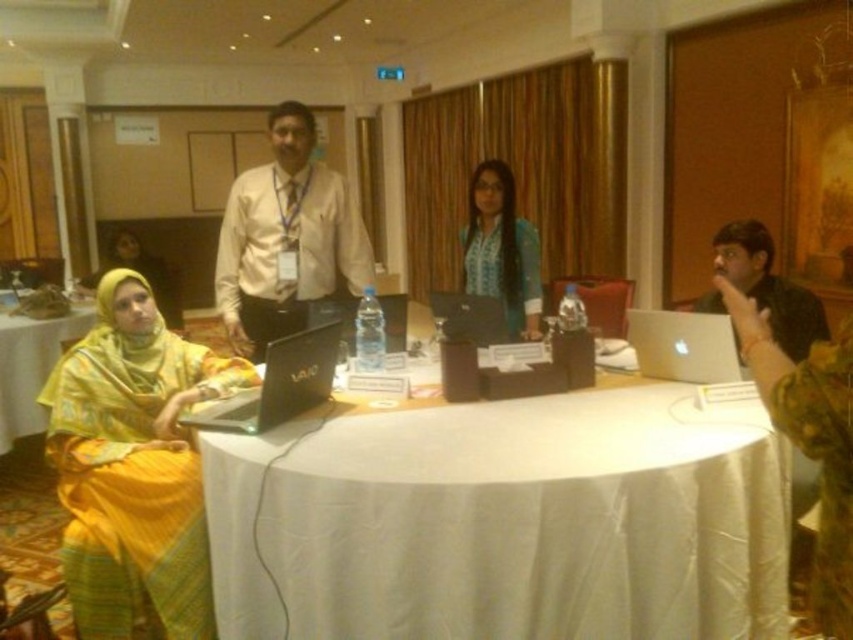
You are a guest attending a formal meeting and need to place your nameplate on the table. The table has a white satin tablecloth at center and you are wearing a blue fabric shirt at center. Can your shirt fit entirely on the tablecloth without overlapping the edges?

The white satin tablecloth at center has a larger width than the blue fabric shirt at center, so yes, the shirt can fit entirely on the tablecloth without overlapping the edges.

You are a guest at this meeting and need to place your nameplate on the table. Where should you put it so that it is visible from both ends of the table? Consider the white satin tablecloth at center and the blue fabric shirt at center in your answer.

The white satin tablecloth at center has a lesser height compared to the blue fabric shirt at center, so placing the nameplate on the white satin tablecloth at center would ensure it is visible from both ends of the table since it is lower and less obstructed by the taller blue fabric shirt at center.

Looking at this image, you are a photographer setting up for a group photo in the meeting room. You need to position two markers at the coordinates point (527,253) and point (33,404). Which marker should you place first if you want to start from the closest point to the camera?

You should place the marker at point (527,253) first because it is closer to the camera compared to point (33,404).